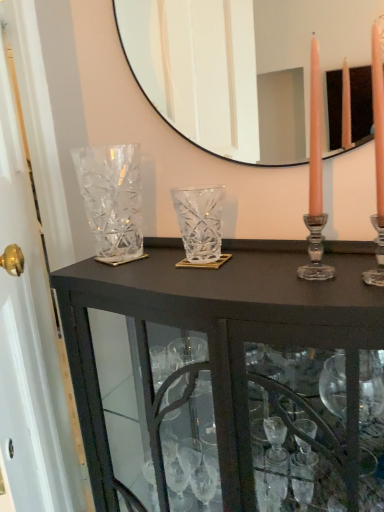
What is the approximate width of clear crystal vase at left, arranged as the 2th glass vase when viewed from the right?

clear crystal vase at left, arranged as the 2th glass vase when viewed from the right, is 12.62 centimeters in width.

Identify the location of clear crystal vase at left, the first glass vase viewed from the left. (112, 199).

What do you see at coordinates (242, 68) in the screenshot?
I see `clear glass mirror at upper center` at bounding box center [242, 68].

This screenshot has height=512, width=384. What do you see at coordinates (200, 222) in the screenshot?
I see `clear crystal vase at center, which is the 1th glass vase in right-to-left order` at bounding box center [200, 222].

This screenshot has height=512, width=384. What do you see at coordinates (39, 259) in the screenshot? I see `clear glass door at left` at bounding box center [39, 259].

You are a GUI agent. You are given a task and a screenshot of the screen. Output one action in this format:
    pyautogui.click(x=<x>, y=<y>)
    Task: Click on the clear glass cabinet at center
    This screenshot has height=512, width=384.
    Given the screenshot: What is the action you would take?
    pyautogui.click(x=222, y=345)

From the image's perspective, is clear glass mirror at upper center above clear crystal vase at center, the 2th glass vase when ordered from left to right?

Correct, clear glass mirror at upper center appears higher than clear crystal vase at center, the 2th glass vase when ordered from left to right, in the image.

Could clear crystal vase at center, the 2th glass vase when ordered from left to right, be considered to be inside clear glass mirror at upper center?

No.

How different are the orientations of clear glass mirror at upper center and clear crystal vase at center, which is the 1th glass vase in right-to-left order, in degrees?

The angular difference between clear glass mirror at upper center and clear crystal vase at center, which is the 1th glass vase in right-to-left order, is 1.35 degrees.

Considering the positions of objects clear crystal vase at left, the first glass vase viewed from the left, and clear glass cabinet at center in the image provided, who is more to the left, clear crystal vase at left, the first glass vase viewed from the left, or clear glass cabinet at center?

clear crystal vase at left, the first glass vase viewed from the left, is more to the left.

Between clear crystal vase at left, arranged as the 2th glass vase when viewed from the right, and clear glass cabinet at center, which one has larger size?

clear glass cabinet at center is bigger.

In terms of height, does clear crystal vase at left, the first glass vase viewed from the left, look taller or shorter compared to clear glass cabinet at center?

Clearly, clear crystal vase at left, the first glass vase viewed from the left, is shorter compared to clear glass cabinet at center.

Considering the positions of objects clear glass door at left and clear crystal vase at left, the first glass vase viewed from the left, in the image provided, who is in front, clear glass door at left or clear crystal vase at left, the first glass vase viewed from the left,?

clear glass door at left is more forward.

Can you confirm if clear glass door at left is smaller than clear crystal vase at left, arranged as the 2th glass vase when viewed from the right?

No.

Is clear glass door at left taller than clear crystal vase at left, arranged as the 2th glass vase when viewed from the right?

Indeed, clear glass door at left has a greater height compared to clear crystal vase at left, arranged as the 2th glass vase when viewed from the right.

Do you think clear glass door at left is within clear crystal vase at center, which is the 1th glass vase in right-to-left order, or outside of it?

The correct answer is: outside.

Considering the sizes of objects clear glass door at left and clear crystal vase at center, the 2th glass vase when ordered from left to right, in the image provided, who is taller, clear glass door at left or clear crystal vase at center, the 2th glass vase when ordered from left to right,?

Standing taller between the two is clear glass door at left.

Does point (41, 499) come farther from viewer compared to point (179, 199)?

No.

Could you tell me if clear crystal vase at center, the 2th glass vase when ordered from left to right, is turned towards clear glass door at left?

No.

From the image's perspective, which one is positioned higher, clear crystal vase at center, which is the 1th glass vase in right-to-left order, or clear glass door at left?

clear crystal vase at center, which is the 1th glass vase in right-to-left order, from the image's perspective.

From a real-world perspective, is clear crystal vase at center, which is the 1th glass vase in right-to-left order, positioned over clear glass door at left based on gravity?

Yes, from a real-world perspective, clear crystal vase at center, which is the 1th glass vase in right-to-left order, is on top of clear glass door at left.

Are clear crystal vase at center, which is the 1th glass vase in right-to-left order, and clear glass door at left making contact?

No, clear crystal vase at center, which is the 1th glass vase in right-to-left order, is not next to clear glass door at left.

Based on the photo, would you consider clear glass cabinet at center to be distant from clear glass door at left?

clear glass cabinet at center is near clear glass door at left, not far away.

Does clear glass cabinet at center turn towards clear glass door at left?

No, clear glass cabinet at center is not turned towards clear glass door at left.

Which is closer, [213,397] or [84,222]?

Point [213,397] is closer to the camera than point [84,222].

Considering the positions of point (184, 64) and point (105, 221), is point (184, 64) closer or farther from the camera than point (105, 221)?

Point (184, 64) is farther from the camera than point (105, 221).

Can you confirm if clear glass mirror at upper center is bigger than clear crystal vase at left, the first glass vase viewed from the left?

Incorrect, clear glass mirror at upper center is not larger than clear crystal vase at left, the first glass vase viewed from the left.

Is clear glass mirror at upper center not inside clear crystal vase at left, arranged as the 2th glass vase when viewed from the right?

Yes, clear glass mirror at upper center is not within clear crystal vase at left, arranged as the 2th glass vase when viewed from the right.

From the image's perspective, which one is positioned lower, clear glass mirror at upper center or clear crystal vase at left, arranged as the 2th glass vase when viewed from the right?

clear crystal vase at left, arranged as the 2th glass vase when viewed from the right, from the image's perspective.

From the image's perspective, starting from the clear glass mirror at upper center, which glass vase is the 2nd one below? Please provide its 2D coordinates.

[(200, 222)]

Find the location of a particular element. The image size is (384, 512). table on the right of clear crystal vase at left, arranged as the 2th glass vase when viewed from the right is located at coordinates (222, 345).

Based on the photo, when comparing their distances from clear crystal vase at center, which is the 1th glass vase in right-to-left order, does clear glass cabinet at center or clear glass mirror at upper center seem closer?

clear glass cabinet at center is closer to clear crystal vase at center, which is the 1th glass vase in right-to-left order.

Estimate the real-world distances between objects in this image. Which object is further from clear crystal vase at center, the 2th glass vase when ordered from left to right, clear glass mirror at upper center or clear glass cabinet at center?

clear glass mirror at upper center is positioned further to the anchor clear crystal vase at center, the 2th glass vase when ordered from left to right.

From the image, which object appears to be nearer to clear crystal vase at left, the first glass vase viewed from the left, clear glass mirror at upper center or clear glass cabinet at center?

Based on the image, clear glass cabinet at center appears to be nearer to clear crystal vase at left, the first glass vase viewed from the left.

Based on their spatial positions, is clear glass door at left or clear crystal vase at center, the 2th glass vase when ordered from left to right, further from clear glass cabinet at center?

Based on the image, clear glass door at left appears to be further to clear glass cabinet at center.

Based on their spatial positions, is clear glass cabinet at center or clear crystal vase at center, the 2th glass vase when ordered from left to right, further from clear glass mirror at upper center?

clear glass cabinet at center is further to clear glass mirror at upper center.

Based on their spatial positions, is clear glass cabinet at center or clear glass mirror at upper center closer to clear glass door at left?

clear glass cabinet at center is positioned closer to the anchor clear glass door at left.

Which object lies further to the anchor point clear glass door at left, clear glass cabinet at center or clear crystal vase at center, the 2th glass vase when ordered from left to right?

clear crystal vase at center, the 2th glass vase when ordered from left to right.

Looking at the image, which one is located closer to clear glass cabinet at center, clear crystal vase at center, which is the 1th glass vase in right-to-left order, or clear crystal vase at left, arranged as the 2th glass vase when viewed from the right?

Among the two, clear crystal vase at center, which is the 1th glass vase in right-to-left order, is located nearer to clear glass cabinet at center.

You are a GUI agent. You are given a task and a screenshot of the screen. Output one action in this format:
    pyautogui.click(x=<x>, y=<y>)
    Task: Click on the glass vase between clear crystal vase at left, the first glass vase viewed from the left, and clear glass cabinet at center vertically
    The image size is (384, 512).
    Given the screenshot: What is the action you would take?
    pyautogui.click(x=200, y=222)

This screenshot has width=384, height=512. Identify the location of glass door that lies between clear crystal vase at left, the first glass vase viewed from the left, and clear glass cabinet at center from top to bottom. tap(39, 259).

This screenshot has width=384, height=512. What are the coordinates of `glass door between clear crystal vase at center, which is the 1th glass vase in right-to-left order, and clear glass cabinet at center from top to bottom` in the screenshot? It's located at (39, 259).

Where is `glass vase between clear glass mirror at upper center and clear crystal vase at center, the 2th glass vase when ordered from left to right, in the vertical direction`? This screenshot has width=384, height=512. glass vase between clear glass mirror at upper center and clear crystal vase at center, the 2th glass vase when ordered from left to right, in the vertical direction is located at coordinates (112, 199).